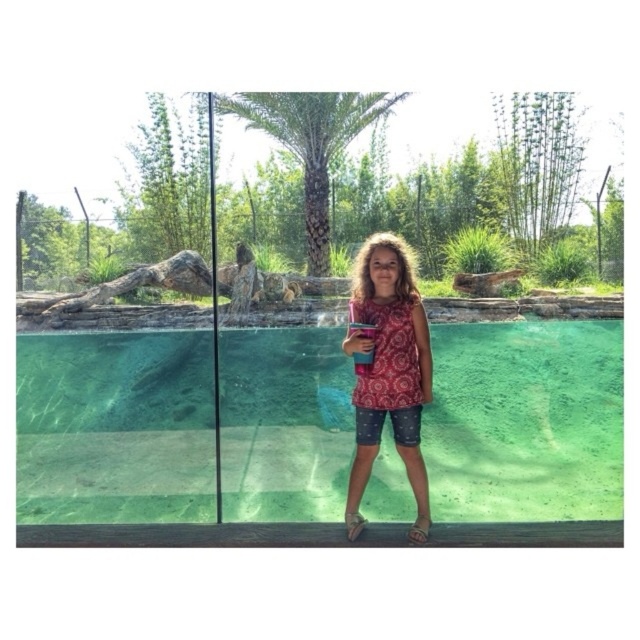
Question: Does clear glass water at center appear on the right side of patterned fabric shirt at center?

Choices:
 (A) no
 (B) yes

Answer: (A)

Question: Is clear glass water at center positioned at the back of patterned fabric shirt at center?

Choices:
 (A) yes
 (B) no

Answer: (A)

Question: Can you confirm if transparent glass door at center is bigger than clear glass water at center?

Choices:
 (A) no
 (B) yes

Answer: (B)

Question: Which point is farther from the camera taking this photo?

Choices:
 (A) (269, 422)
 (B) (384, 147)

Answer: (B)

Question: Estimate the real-world distances between objects in this image. Which object is closer to the transparent glass door at center?

Choices:
 (A) clear glass water at center
 (B) patterned fabric shirt at center

Answer: (B)

Question: Which point appears farthest from the camera in this image?

Choices:
 (A) (589, 502)
 (B) (392, 328)

Answer: (A)